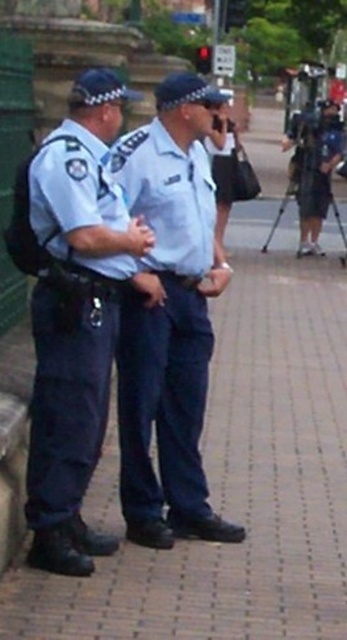
You are standing at the point marked by the coordinates point [131,419]. You want to walk towards the traffic light in the background. Is the traffic light in front of you or behind you?

The traffic light is in front of you because the point [131,419] is 14.05 feet from the viewer, so walking towards the traffic light would mean moving forward from that point.

You are a tailor who needs to adjust the blue uniform at center and the matte blue uniform at left to ensure they fit properly. Based on the scene, which uniform requires more fabric for alterations?

The blue uniform at center requires more fabric for alterations because it has a larger size compared to the matte blue uniform at left.

You are a pedestrian trying to cross the street and see two points marked as point (x=189, y=429) and point (x=43, y=288) in the image. Which point is closer to the traffic light?

Point (x=43, y=288) is closer to the traffic light because it is in front of point (x=189, y=429), which is behind it.